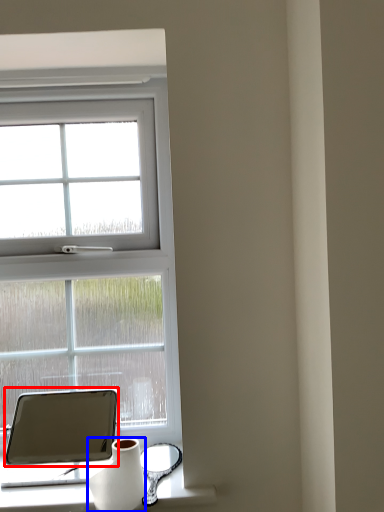
Question: Which of the following is the farthest to the observer, tablet computer (highlighted by a red box) or vase (highlighted by a blue box)?

Choices:
 (A) tablet computer
 (B) vase

Answer: (A)